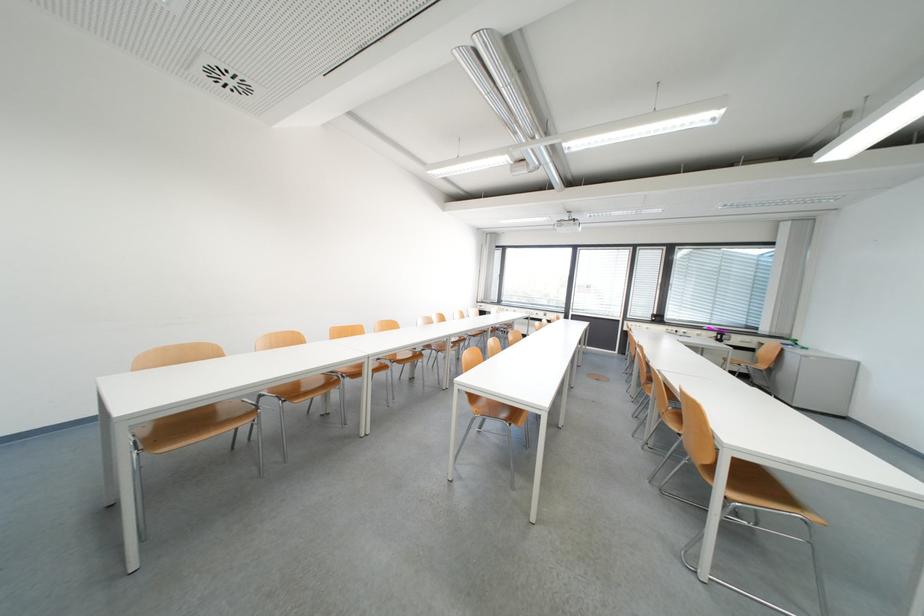
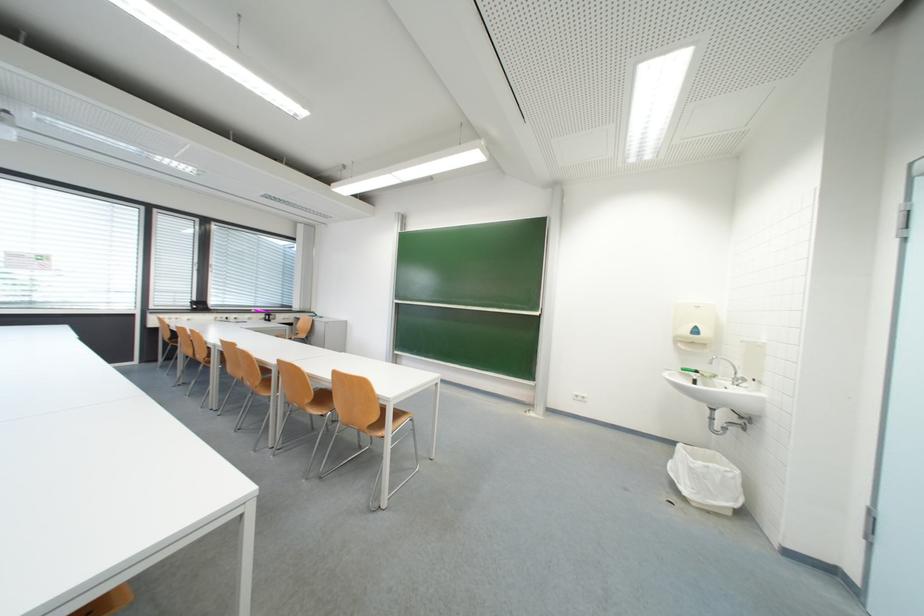
Question: The images are taken continuously from a first-person perspective. In which direction is your viewpoint rotating?

Choices:
 (A) Left
 (B) Right
 (C) Up
 (D) Down

Answer: (B)